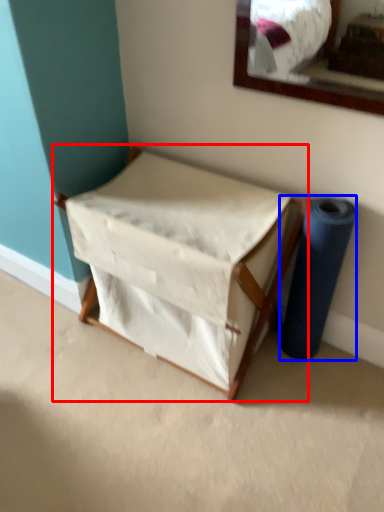
Question: Which object is further to the camera taking this photo, furniture (highlighted by a red box) or duct tape (highlighted by a blue box)?

Choices:
 (A) furniture
 (B) duct tape

Answer: (B)